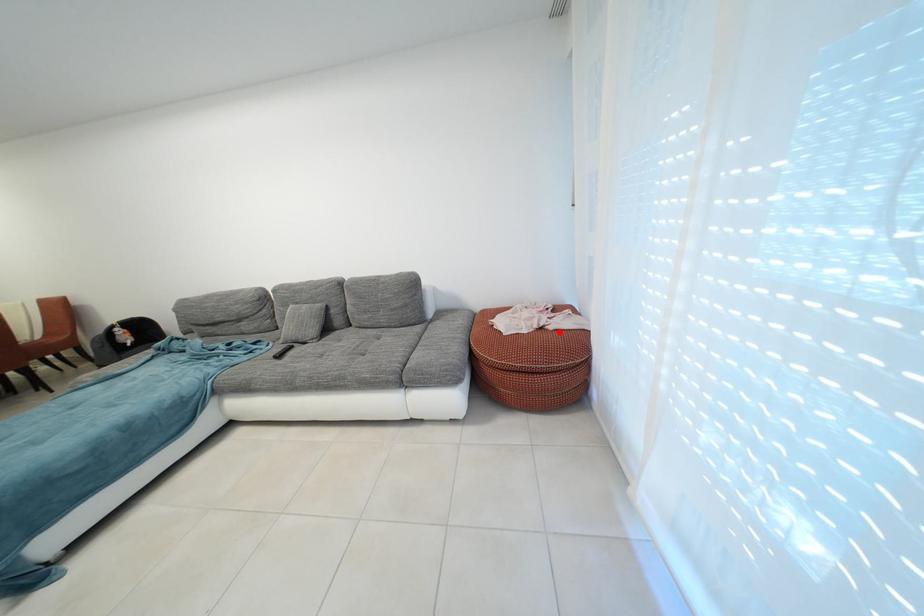
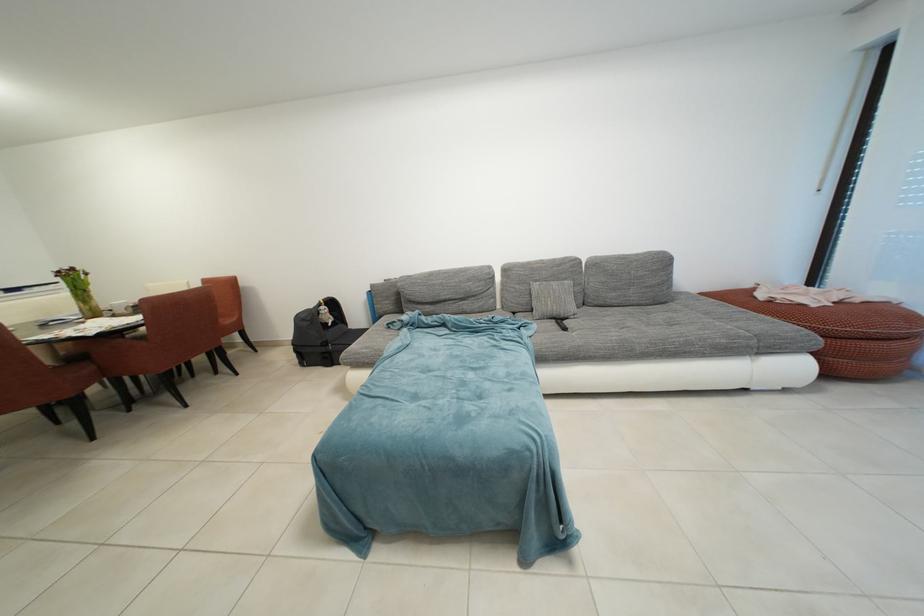
Find the pixel in the second image that matches the highlighted location in the first image.

(865, 305)